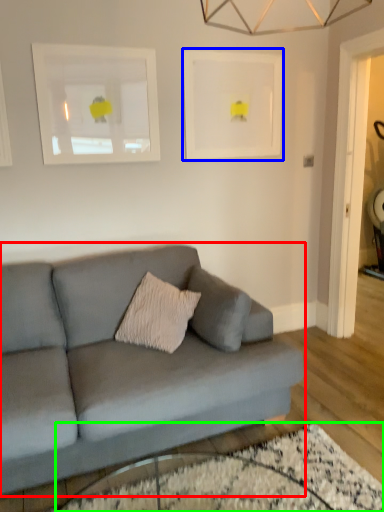
Question: Estimate the real-world distances between objects in this image. Which object is closer to studio couch (highlighted by a red box), picture frame (highlighted by a blue box) or glass table (highlighted by a green box)?

Choices:
 (A) picture frame
 (B) glass table

Answer: (B)